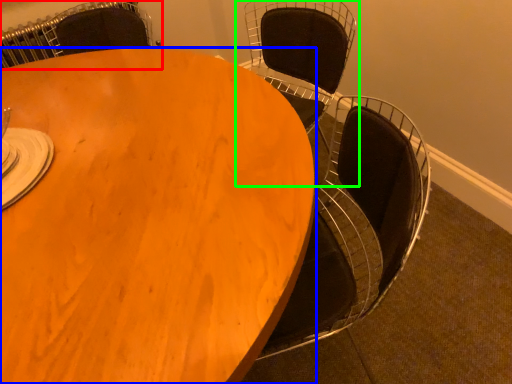
Question: Which object is the farthest from chair (highlighted by a red box)? Choose among these: table (highlighted by a blue box) or chair (highlighted by a green box).

Choices:
 (A) table
 (B) chair

Answer: (A)